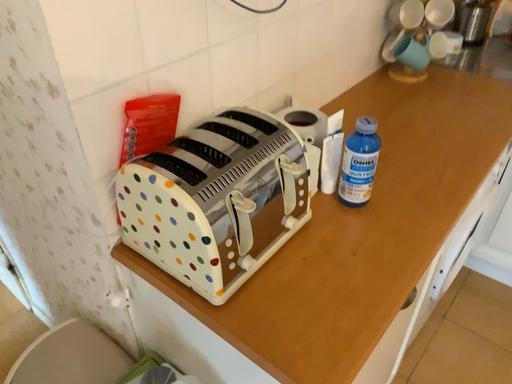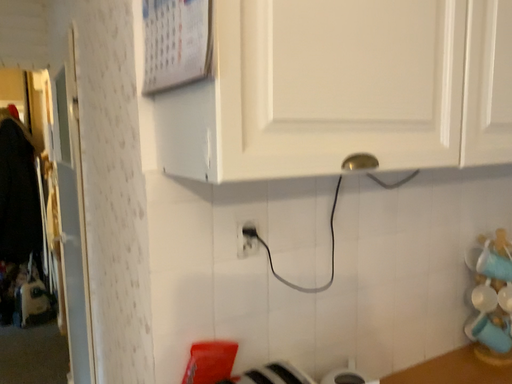
Question: Which way did the camera rotate in the video?

Choices:
 (A) rotated left
 (B) rotated right

Answer: (A)